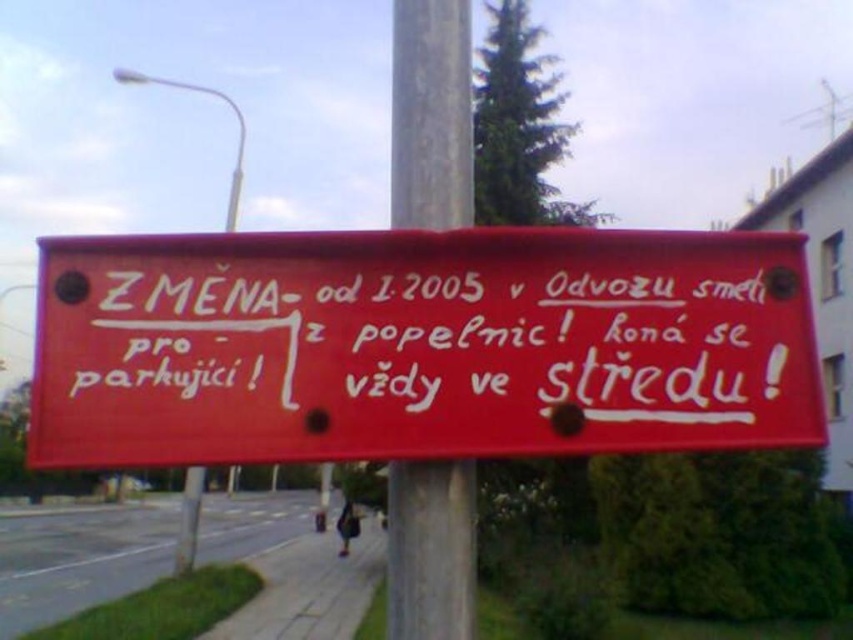
Question: Which of these objects is positioned farthest from the metallic pole at center?

Choices:
 (A) smooth gray pole at center
 (B) matte red sign at center

Answer: (A)

Question: Observing the image, what is the correct spatial positioning of smooth gray pole at center in reference to metallic pole at center?

Choices:
 (A) above
 (B) below

Answer: (A)

Question: From the image, what is the correct spatial relationship of matte red sign at center in relation to smooth gray pole at center?

Choices:
 (A) below
 (B) above

Answer: (B)

Question: Does smooth gray pole at center have a smaller size compared to metallic pole at center?

Choices:
 (A) yes
 (B) no

Answer: (A)

Question: Which point is farther to the camera?

Choices:
 (A) smooth gray pole at center
 (B) matte red sign at center

Answer: (A)

Question: Which point appears closest to the camera in this image?

Choices:
 (A) (462, 10)
 (B) (119, 465)
 (C) (189, 472)

Answer: (B)